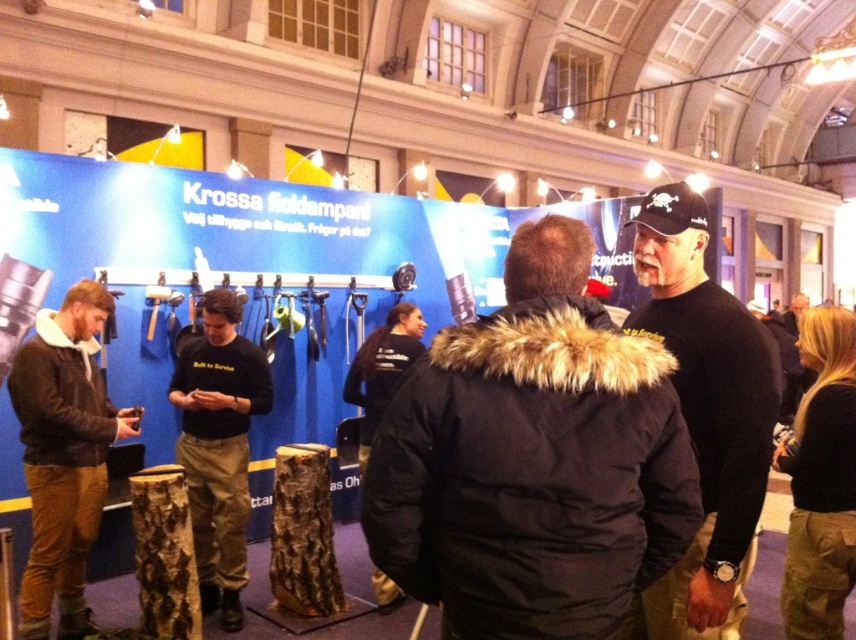
You are navigating through the exhibition hall and need to move from point A to point B. Point A is located at coordinates point (x=716, y=461) and point B is at point (x=791, y=326). According to the image, which point is closer to you as you stand facing the booth?

Point (x=716, y=461) is in front of point (x=791, y=326), so point A is closer to you as you stand facing the booth.